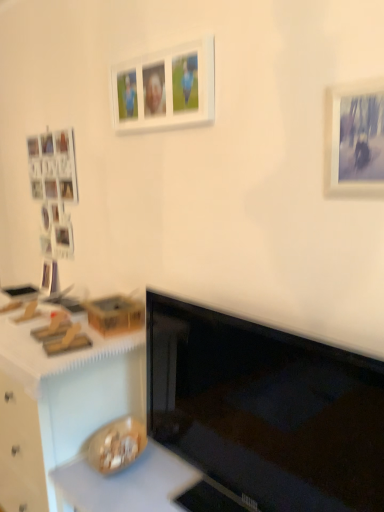
Locate an element on the screen. This screenshot has width=384, height=512. free location above smooth white countertop at lower center, which is the 2th counter top from top to bottom (from a real-world perspective) is located at coordinates (153, 480).